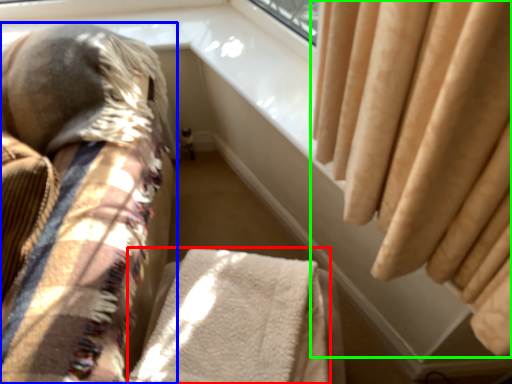
Question: Considering the real-world distances, which object is farthest from blanket (highlighted by a red box)? furniture (highlighted by a blue box) or curtain (highlighted by a green box)?

Choices:
 (A) furniture
 (B) curtain

Answer: (B)